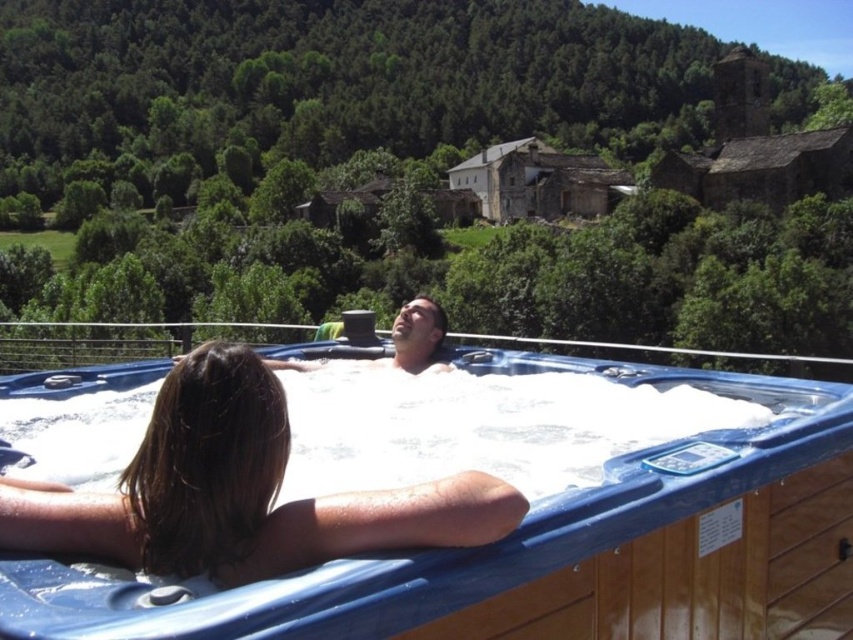
Question: Does white foamy water at center appear under matte blue hot tub at center?

Choices:
 (A) no
 (B) yes

Answer: (B)

Question: Does white foamy water at center appear over matte blue hot tub at center?

Choices:
 (A) no
 (B) yes

Answer: (A)

Question: Based on their relative distances, which object is farther from the blue plastic hot tub at center?

Choices:
 (A) white foamy water at center
 (B) matte blue hot tub at center

Answer: (B)

Question: Is blue plastic hot tub at center positioned before matte blue hot tub at center?

Choices:
 (A) no
 (B) yes

Answer: (B)

Question: Estimate the real-world distances between objects in this image. Which object is farther from the white foamy water at center?

Choices:
 (A) blue plastic hot tub at center
 (B) matte blue hot tub at center

Answer: (B)

Question: Among these points, which one is farthest from the camera?

Choices:
 (A) (294, 358)
 (B) (548, 456)
 (C) (732, 634)

Answer: (A)